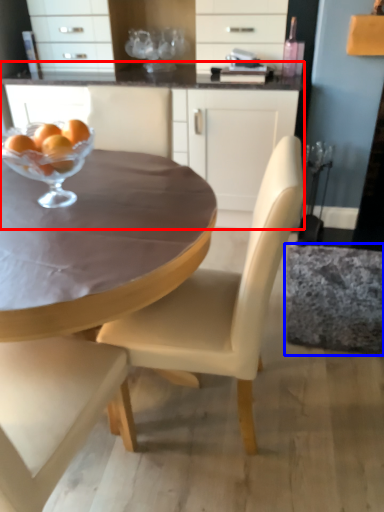
Question: Which object is closer to the camera taking this photo, cabinetry (highlighted by a red box) or swivel chair (highlighted by a blue box)?

Choices:
 (A) cabinetry
 (B) swivel chair

Answer: (B)